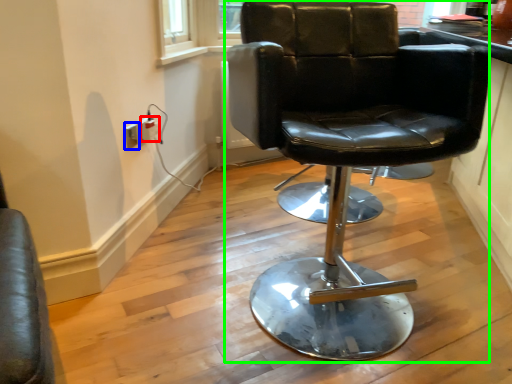
Question: Which is farther away from electric outlet (highlighted by a red box)? electric outlet (highlighted by a blue box) or chair (highlighted by a green box)?

Choices:
 (A) electric outlet
 (B) chair

Answer: (B)